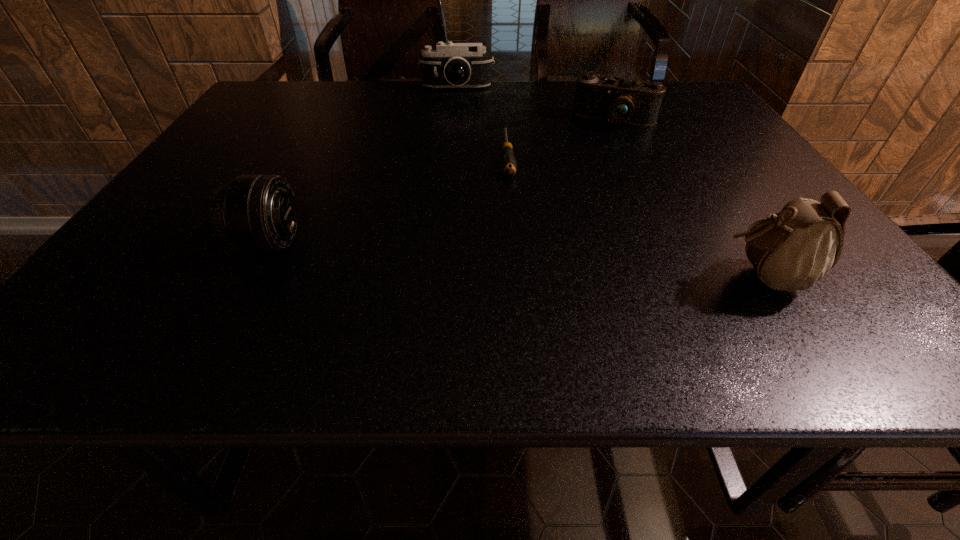
The image size is (960, 540). I want to click on free spot on the desktop that is between the leftmost object and the tallest object and is positioned on the lens of the right camera, so click(573, 264).

Identify the location of free space on the desktop that is between the leftmost object and the pouch and is positioned at the tip of the third object from right to left. [518, 260].

Locate an element on the screen. free spot on the desktop that is between the telephoto lens and the pouch and is positioned on the front lens of the taller camera is located at coordinates (454, 255).